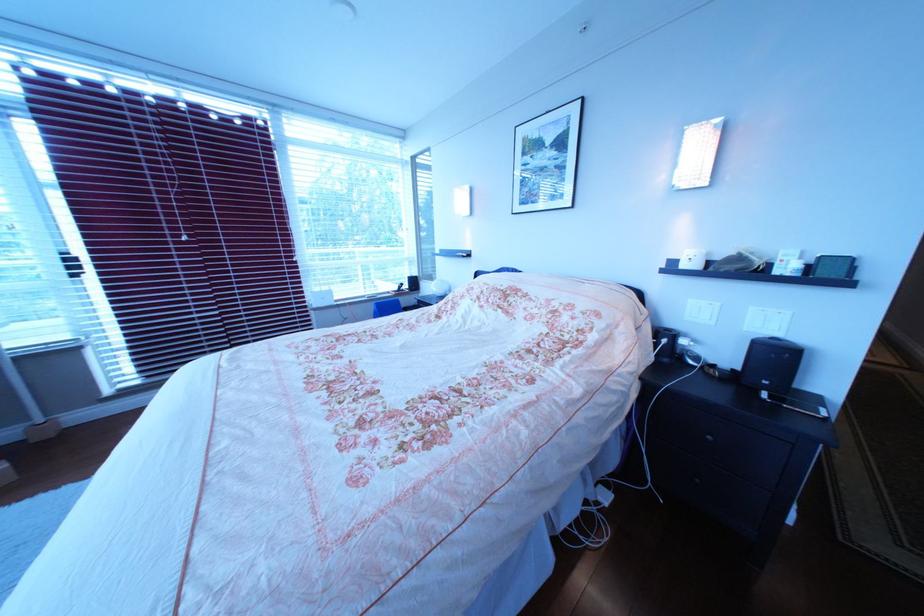
Image resolution: width=924 pixels, height=616 pixels. Describe the element at coordinates (166, 168) in the screenshot. I see `the blind pull cord` at that location.